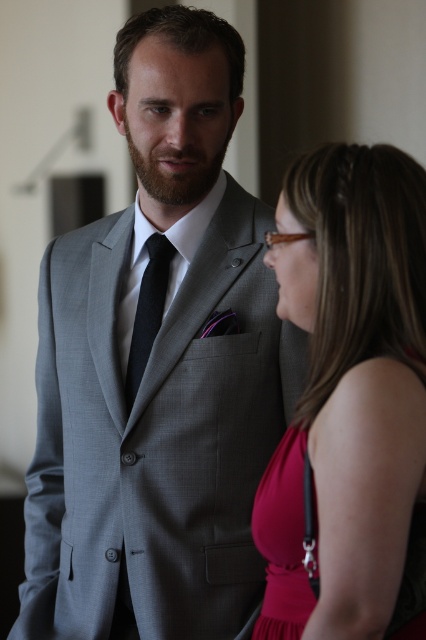
What do you see at coordinates (285, 538) in the screenshot? I see `matte pink fabric dress at lower right` at bounding box center [285, 538].

Measure the distance between matte pink fabric dress at lower right and camera.

matte pink fabric dress at lower right and camera are 4.19 feet apart.

Does point (311, 502) lie in front of point (129, 412)?

Yes, point (311, 502) is closer to viewer.

Identify the location of matte pink fabric dress at lower right. The image size is (426, 640). coord(285,538).

Does point (253, 380) lie behind point (362, 308)?

Yes, it is behind point (362, 308).

Measure the distance between point (106, 397) and camera.

They are 1.72 meters apart.

The image size is (426, 640). Find the location of `matte gray suit at center`. matte gray suit at center is located at coordinates (158, 368).

Is matte pink dress at right in front of black silk tie at center?

Yes, matte pink dress at right is in front of black silk tie at center.

How far apart are matte pink dress at right and black silk tie at center?

They are 53.23 centimeters apart.

The image size is (426, 640). What do you see at coordinates (347, 392) in the screenshot?
I see `matte pink dress at right` at bounding box center [347, 392].

Identify the location of matte pink dress at right. (347, 392).